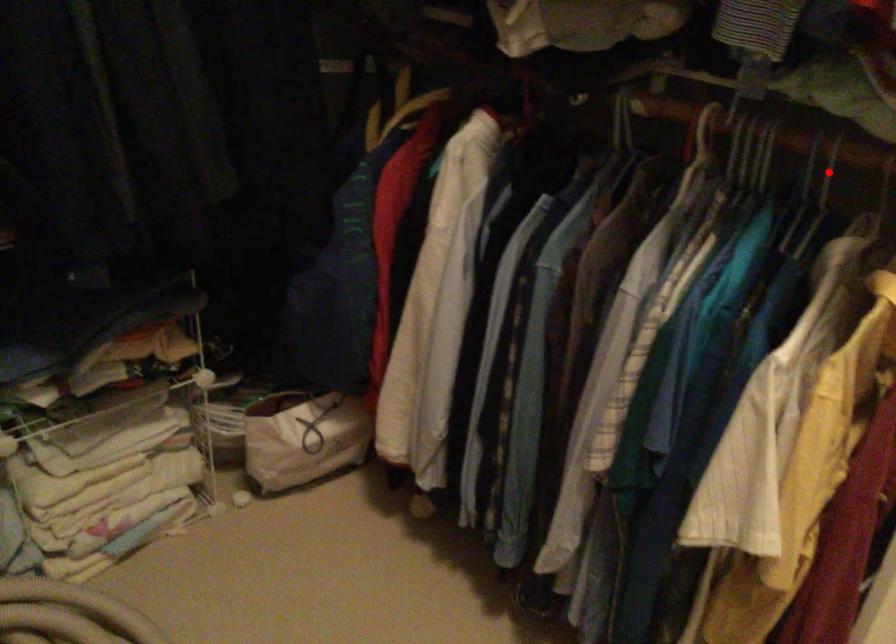
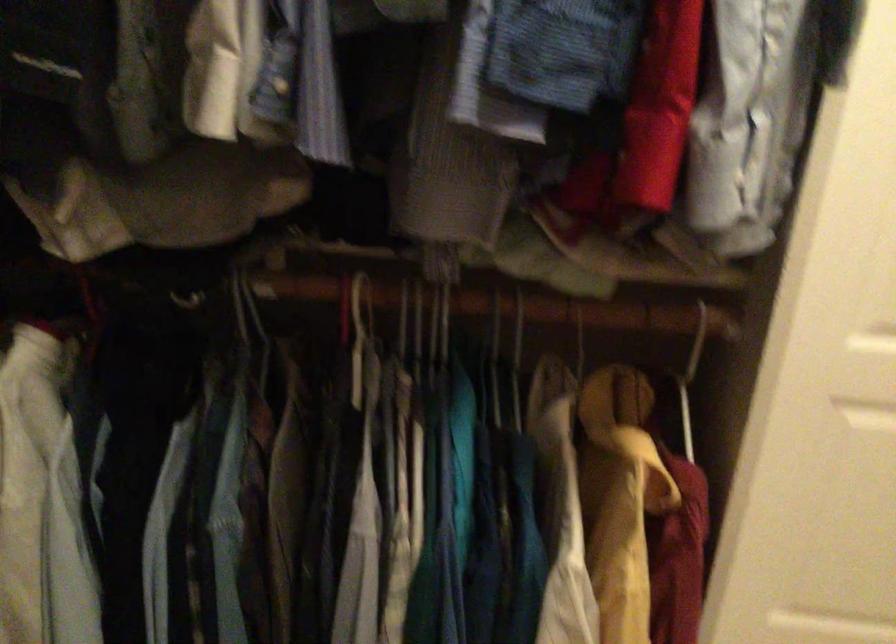
The point at the highlighted location is marked in the first image. Where is the corresponding point in the second image?

(457, 299)